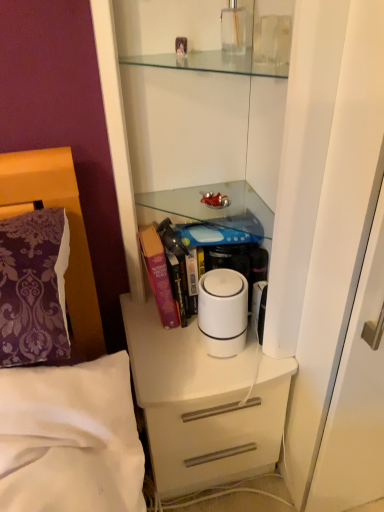
The width and height of the screenshot is (384, 512). Find the location of `free space above white matte chest of drawers at center (from a real-world perspective)`. free space above white matte chest of drawers at center (from a real-world perspective) is located at coordinates (188, 345).